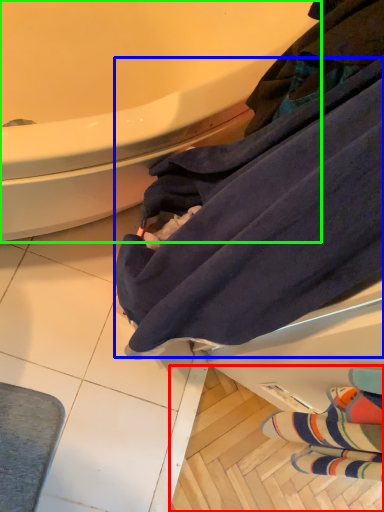
Question: Estimate the real-world distances between objects in this image. Which object is farther from tile (highlighted by a red box), bath towel (highlighted by a blue box) or bathtub (highlighted by a green box)?

Choices:
 (A) bath towel
 (B) bathtub

Answer: (B)